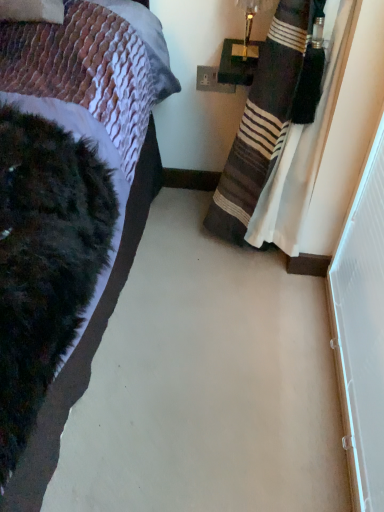
Question: Is white plastic power outlet at upper center wider than striped fabric curtain at right?

Choices:
 (A) yes
 (B) no

Answer: (B)

Question: Can you confirm if white plastic power outlet at upper center is taller than striped fabric curtain at right?

Choices:
 (A) no
 (B) yes

Answer: (A)

Question: Considering the relative sizes of white plastic power outlet at upper center and striped fabric curtain at right in the image provided, is white plastic power outlet at upper center bigger than striped fabric curtain at right?

Choices:
 (A) no
 (B) yes

Answer: (A)

Question: Does white plastic power outlet at upper center have a lesser height compared to striped fabric curtain at right?

Choices:
 (A) no
 (B) yes

Answer: (B)

Question: From a real-world perspective, is white plastic power outlet at upper center on top of striped fabric curtain at right?

Choices:
 (A) no
 (B) yes

Answer: (B)

Question: From a real-world perspective, is white plastic power outlet at upper center beneath striped fabric curtain at right?

Choices:
 (A) no
 (B) yes

Answer: (A)

Question: From a real-world perspective, does striped fabric curtain at right sit lower than metallic gold lamp at upper right?

Choices:
 (A) no
 (B) yes

Answer: (B)

Question: Is metallic gold lamp at upper right located within striped fabric curtain at right?

Choices:
 (A) no
 (B) yes

Answer: (A)

Question: Is striped fabric curtain at right turned away from metallic gold lamp at upper right?

Choices:
 (A) no
 (B) yes

Answer: (A)

Question: Is striped fabric curtain at right wider than metallic gold lamp at upper right?

Choices:
 (A) yes
 (B) no

Answer: (A)

Question: Is striped fabric curtain at right aimed at metallic gold lamp at upper right?

Choices:
 (A) no
 (B) yes

Answer: (A)

Question: Considering the relative sizes of striped fabric curtain at right and metallic gold lamp at upper right in the image provided, is striped fabric curtain at right bigger than metallic gold lamp at upper right?

Choices:
 (A) yes
 (B) no

Answer: (A)

Question: Does white plastic screen door at right turn towards white plastic power outlet at upper center?

Choices:
 (A) yes
 (B) no

Answer: (B)